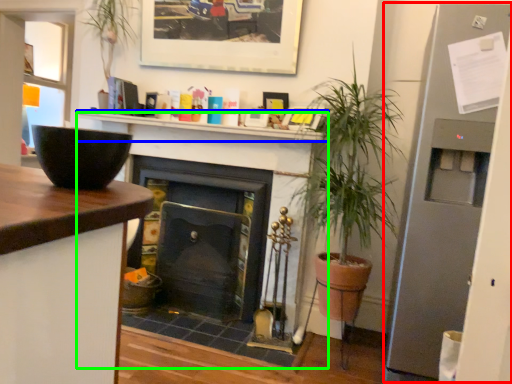
Question: Estimate the real-world distances between objects in this image. Which object is farther from fridge (highlighted by a red box), shelf (highlighted by a blue box) or fireplace (highlighted by a green box)?

Choices:
 (A) shelf
 (B) fireplace

Answer: (B)